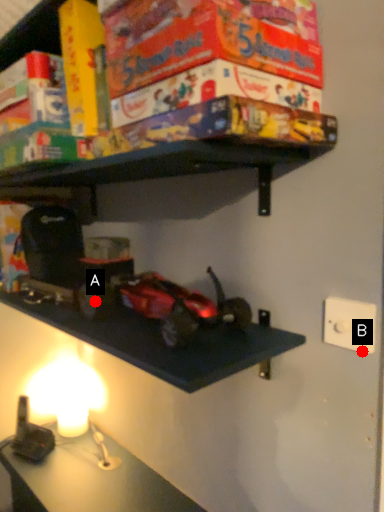
Question: Two points are circled on the image, labeled by A and B beside each circle. Which point is closer to the camera?

Choices:
 (A) A is closer
 (B) B is closer

Answer: (B)